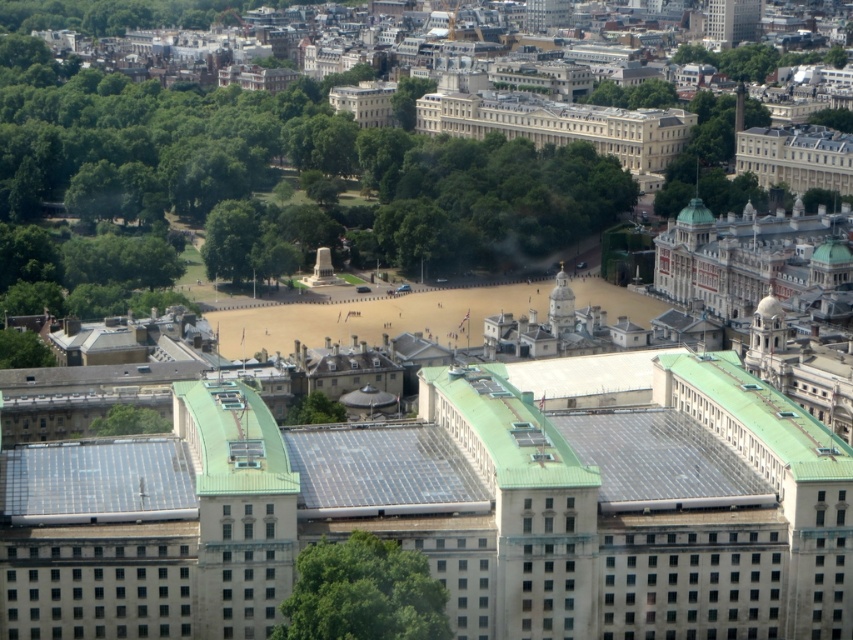
You are a drone operator flying over the city. You see two points marked on your map. The first point is at coordinate point (x=416, y=502) and the second point is at coordinate point (x=653, y=378). From your aerial view, which point is closer to the large symmetrical building with a green roof?

Point (x=416, y=502) is in front of point (x=653, y=378), so it is closer to the large symmetrical building with a green roof.

You are a city planner reviewing the aerial view of the city. You need to install a new communication tower that must be placed exactly at the center of the city. The transparent solar panels at center are currently occupying the central point. Can the tower be placed there without displacing the solar panels?

The transparent solar panels at center are located at point (381,470), which is the central point of the city. Therefore, the communication tower cannot be placed there without displacing the solar panels.